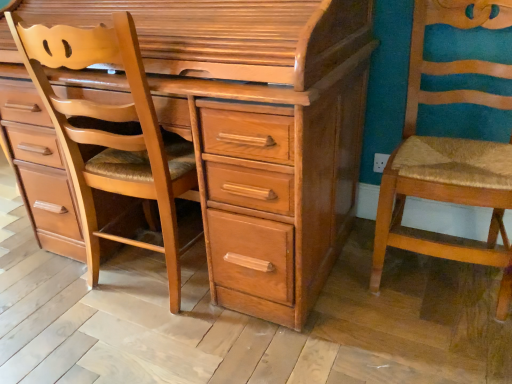
Question: Looking at their shapes, would you say light brown wood chair at left is wider or thinner than wooden textured chair at right?

Choices:
 (A) thin
 (B) wide

Answer: (A)

Question: Considering the relative positions of light brown wood chair at left and wooden textured chair at right in the image provided, is light brown wood chair at left to the left or to the right of wooden textured chair at right?

Choices:
 (A) right
 (B) left

Answer: (B)

Question: Estimate the real-world distances between objects in this image. Which object is farther from the wooden textured chair at right?

Choices:
 (A) light brown wood chest of drawers at center
 (B) light brown wood chair at left

Answer: (B)

Question: Estimate the real-world distances between objects in this image. Which object is closer to the light brown wood chest of drawers at center?

Choices:
 (A) light brown wood chair at left
 (B) wooden textured chair at right

Answer: (A)